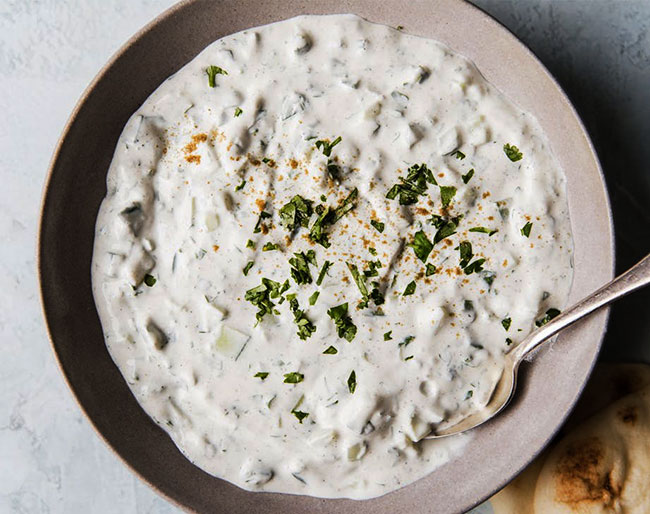
Locate an element on the screen. The image size is (650, 514). spoon resting on bowl right side is located at coordinates (632, 276).